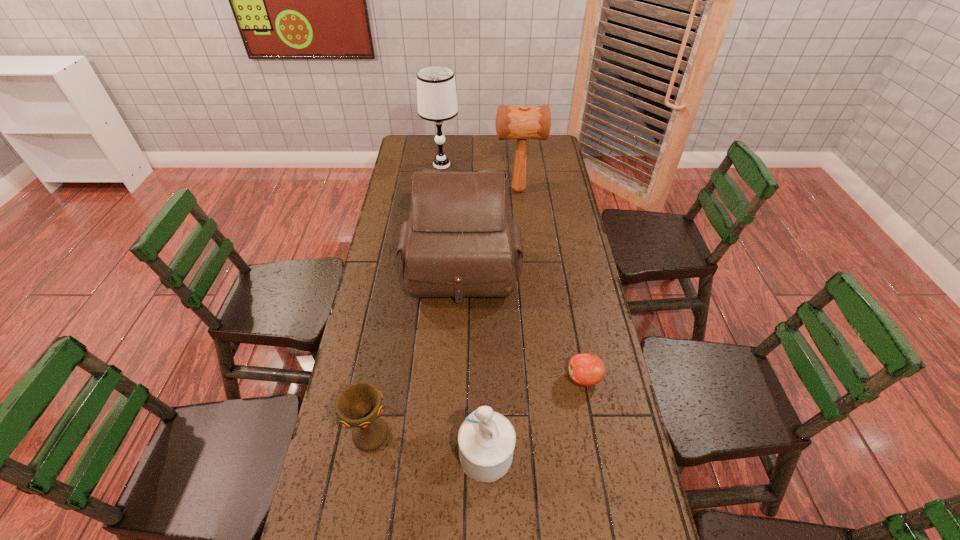
Identify the location of vacant space located 0.240m on the strike surface of the fifth nearest object. This screenshot has height=540, width=960. (439, 190).

Locate an element on the screen. The height and width of the screenshot is (540, 960). free space located on the front flap of the satchel is located at coordinates (457, 400).

You are a GUI agent. You are given a task and a screenshot of the screen. Output one action in this format:
    pyautogui.click(x=<x>, y=<y>)
    Task: Click on the free space located at the beak of the third shortest object
    The image size is (960, 540).
    Given the screenshot: What is the action you would take?
    (x=357, y=454)

You are a GUI agent. You are given a task and a screenshot of the screen. Output one action in this format:
    pyautogui.click(x=<x>, y=<y>)
    Task: Click on the vacant point located 0.090m at the beak of the third shortest object
    The image size is (960, 540).
    Given the screenshot: What is the action you would take?
    pyautogui.click(x=423, y=454)

Find the location of a particular element. free space located at the beak of the third shortest object is located at coordinates (369, 454).

The image size is (960, 540). What are the coordinates of `vacant area located 0.060m on the right of the fifth tallest object` in the screenshot? It's located at (416, 434).

Image resolution: width=960 pixels, height=540 pixels. What are the coordinates of `vacant space located 0.100m on the left of the shortest object` in the screenshot? It's located at (533, 379).

Where is `object present at the far edge`? This screenshot has height=540, width=960. object present at the far edge is located at coordinates (436, 91).

You are a GUI agent. You are given a task and a screenshot of the screen. Output one action in this format:
    pyautogui.click(x=<x>, y=<y>)
    Task: Click on the table lamp that is positioned at the left edge
    Image resolution: width=960 pixels, height=540 pixels.
    Given the screenshot: What is the action you would take?
    pyautogui.click(x=436, y=91)

Identify the location of satchel that is at the left edge. This screenshot has width=960, height=540. (460, 240).